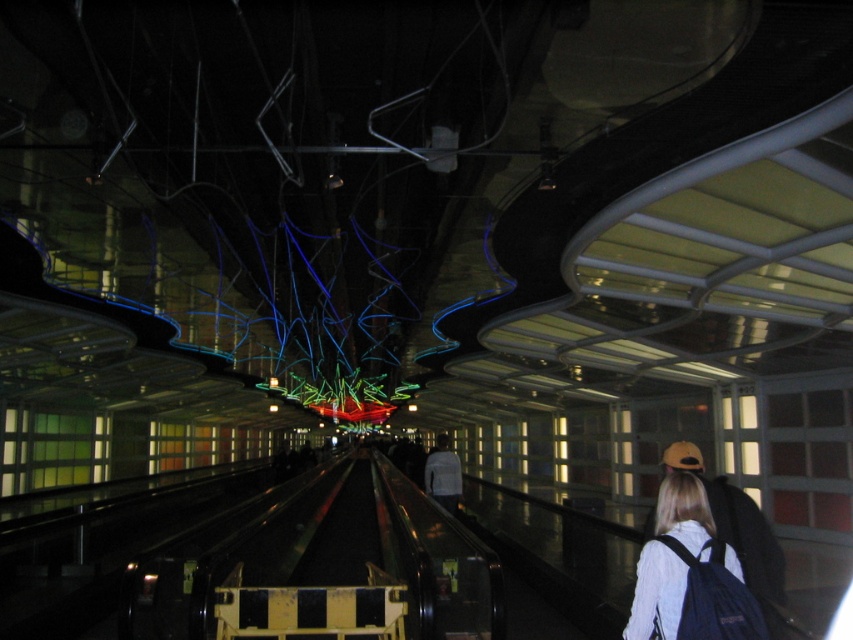
Image resolution: width=853 pixels, height=640 pixels. Identify the location of blue backpack at lower right. (656, 593).

Is the position of blue backpack at lower right less distant than that of white matte shirt at center?

Yes, it is in front of white matte shirt at center.

Describe the element at coordinates (656, 593) in the screenshot. I see `blue backpack at lower right` at that location.

You are a GUI agent. You are given a task and a screenshot of the screen. Output one action in this format:
    pyautogui.click(x=<x>, y=<y>)
    Task: Click on the blue backpack at lower right
    
    Given the screenshot: What is the action you would take?
    pyautogui.click(x=656, y=593)